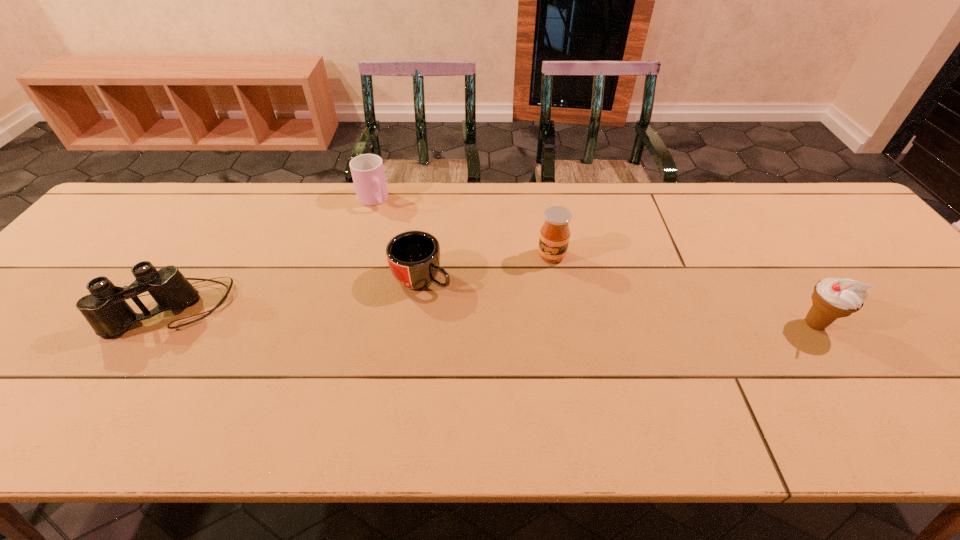
Locate an element on the screen. The width and height of the screenshot is (960, 540). free space on the desktop that is between the binoculars and the icecream and is positioned on the side of the shortest object with the handle is located at coordinates (489, 316).

You are a GUI agent. You are given a task and a screenshot of the screen. Output one action in this format:
    pyautogui.click(x=<x>, y=<y>)
    Task: Click on the vacant spot on the desktop that is between the binoculars and the rightmost object and is positioned with the handle on the side of the cup
    The height and width of the screenshot is (540, 960).
    Given the screenshot: What is the action you would take?
    pyautogui.click(x=478, y=316)

Locate an element on the screen. The image size is (960, 540). vacant spot on the desktop that is between the leftmost object and the rightmost object and is positioned on the front-facing side of the honey is located at coordinates (534, 317).